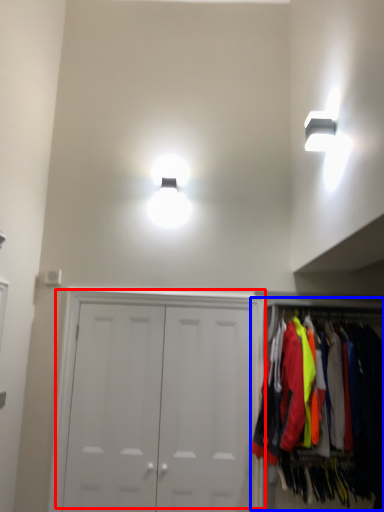
Question: Which object appears closest to the camera in this image, door (highlighted by a red box) or closet (highlighted by a blue box)?

Choices:
 (A) door
 (B) closet

Answer: (B)